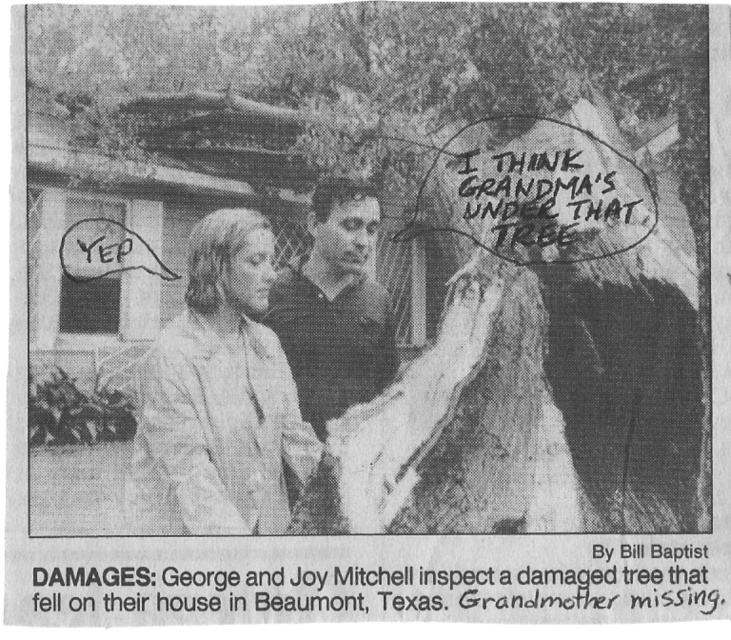
Question: Considering the real-world distances, which object is closest to the dark gray shirt at center?

Choices:
 (A) light beige fabric jacket at left
 (B) black handwritten text at upper center

Answer: (A)

Question: Which object appears closest to the camera in this image?

Choices:
 (A) light beige fabric jacket at left
 (B) dark gray shirt at center
 (C) damaged wood tree at center

Answer: (C)

Question: Is light beige fabric jacket at left wider than dark gray shirt at center?

Choices:
 (A) no
 (B) yes

Answer: (B)

Question: Does light beige fabric jacket at left have a larger size compared to dark gray shirt at center?

Choices:
 (A) yes
 (B) no

Answer: (A)

Question: Which of the following is the farthest from the observer?

Choices:
 (A) [583, 236]
 (B) [273, 252]
 (C) [477, 552]
 (D) [352, 368]

Answer: (D)

Question: Does damaged wood tree at center appear under black handwritten text at upper center?

Choices:
 (A) no
 (B) yes

Answer: (B)